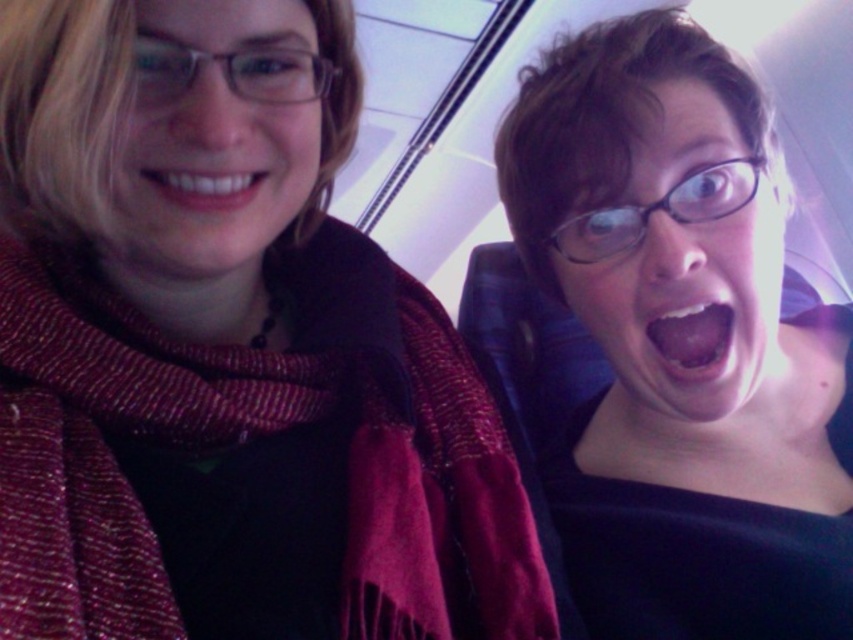
Can you confirm if woven wool scarf at left is positioned above black glossy glasses at upper right?

No.

Is woven wool scarf at left thinner than black glossy glasses at upper right?

No.

Is point (309, 513) more distant than point (646, 337)?

No, it is not.

At what (x,y) coordinates should I click in order to perform the action: click on woven wool scarf at left. Please return your answer as a coordinate pair (x, y). The height and width of the screenshot is (640, 853). Looking at the image, I should click on (256, 467).

Between woven wool scarf at left and pink glossy lips at center, which one has less height?

pink glossy lips at center is shorter.

Who is more forward, (393,616) or (670,344)?

Point (393,616) is more forward.

Locate an element on the screen. The width and height of the screenshot is (853, 640). woven wool scarf at left is located at coordinates (256, 467).

What do you see at coordinates (256, 467) in the screenshot? The image size is (853, 640). I see `woven wool scarf at left` at bounding box center [256, 467].

Can you confirm if woven wool scarf at left is wider than matte black scarf at left?

Yes, woven wool scarf at left is wider than matte black scarf at left.

Between point (364, 252) and point (212, 152), which one is positioned behind?

Positioned behind is point (364, 252).

This screenshot has height=640, width=853. In order to click on woven wool scarf at left in this screenshot , I will do `click(256, 467)`.